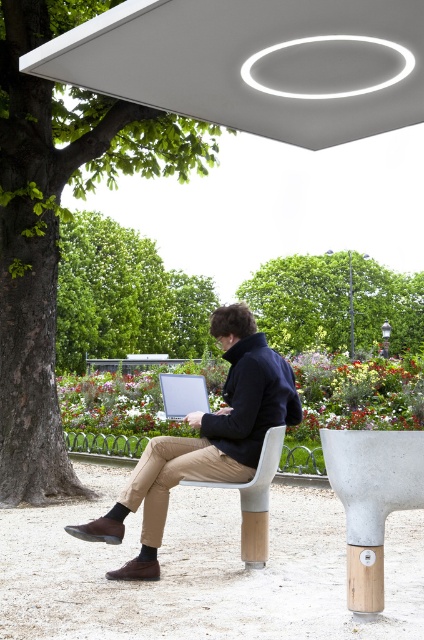
Is matte black jacket at center to the left of satin silver laptop at center from the viewer's perspective?

In fact, matte black jacket at center is to the right of satin silver laptop at center.

Is matte black jacket at center to the right of satin silver laptop at center from the viewer's perspective?

Yes, matte black jacket at center is to the right of satin silver laptop at center.

Locate an element on the screen. The width and height of the screenshot is (424, 640). matte black jacket at center is located at coordinates (204, 440).

Consider the image. Is green leafy tree at left shorter than matte black jacket at center?

No.

Does green leafy tree at left appear over matte black jacket at center?

Correct, green leafy tree at left is located above matte black jacket at center.

Between point (52, 112) and point (239, 397), which one is positioned in front?

Point (239, 397) is more forward.

Image resolution: width=424 pixels, height=640 pixels. Find the location of `green leafy tree at left`. green leafy tree at left is located at coordinates (58, 225).

Does green leafy tree at left appear under green leafy tree at upper center?

No.

Measure the distance between green leafy tree at left and green leafy tree at upper center.

green leafy tree at left and green leafy tree at upper center are 33.41 meters apart.

Is point (24, 316) positioned in front of point (326, 276)?

Yes, point (24, 316) is in front of point (326, 276).

Locate an element on the screen. green leafy tree at left is located at coordinates (58, 225).